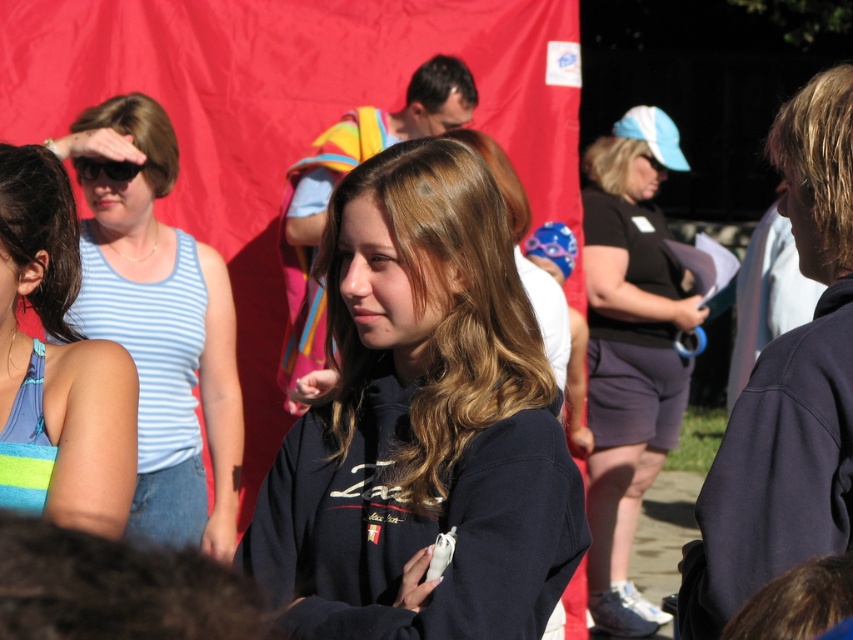
Based on the scene description, which person is positioned to the right of the other between the brownsmoothhair at center and dark brown hair at left?

The brownsmoothhair at center is positioned to the right of the dark brown hair at left.

You are a photographer at this event and want to adjust the camera focus to ensure both the brownsmoothhair at center and the dark brown hair at left are in frame. Based on their positions, which subject should you focus on first to maintain both in the shot?

The brownsmoothhair at center is located below the dark brown hair at left, so focusing on the dark brown hair at left first will ensure both subjects remain in the frame as the brownsmoothhair at center is positioned lower.